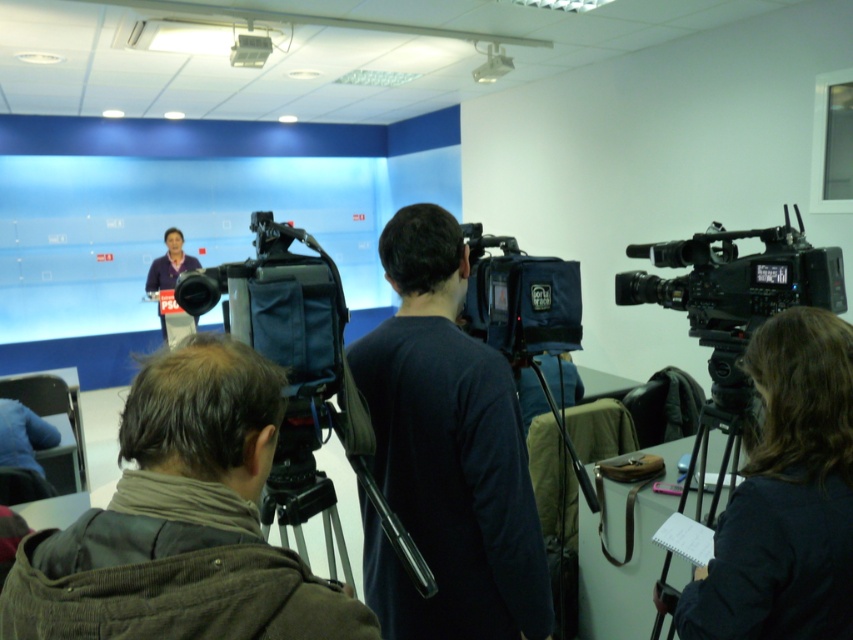
You are organizing a photo shoot and need to place the black plastic camera at right and the matte purple shirt at center in a display case. The case has limited space. Based on their sizes, which item should you prioritize placing first to ensure both fit?

The black plastic camera at right occupies less space than the matte purple shirt at center, so you should prioritize placing the matte purple shirt at center first to ensure both fit in the display case.

You are standing in the press conference room and want to move from point A at point (695, 520) to point B at point (248, 49). Which direction should you move to get closer to point B?

To move from point A at point (695, 520) to point B at point (248, 49), you should move towards the lower left direction since point B is located at a lower and leftward position relative to point A.

You are a photographer standing in the front row of the press conference. You need to take a photo of the matte purple shirt at center without the black matte video camera at center blocking the view. Is this possible?

The black matte video camera at center is much taller than the matte purple shirt at center, so it will block the view of the matte purple shirt at center. Therefore, you cannot take a photo of the matte purple shirt at center without the camera blocking it.